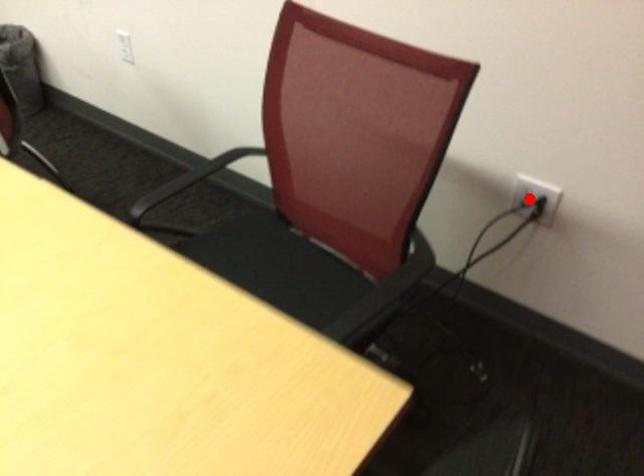
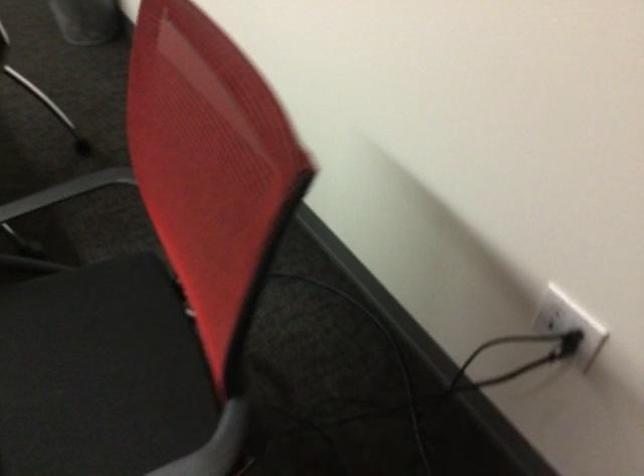
Locate, in the second image, the point that corresponds to the highlighted location in the first image.

(554, 312)